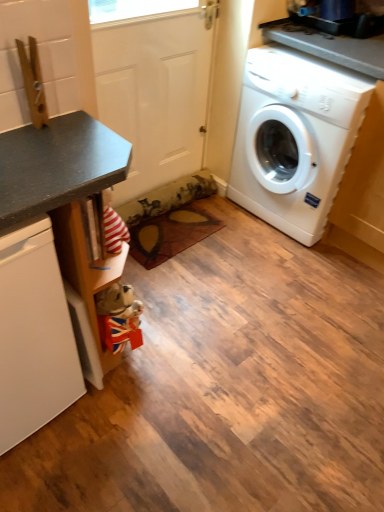
Question: Does white plastic washing machine at right have a lesser height compared to white matte dishwasher at left?

Choices:
 (A) yes
 (B) no

Answer: (B)

Question: Does white plastic washing machine at right touch white matte dishwasher at left?

Choices:
 (A) no
 (B) yes

Answer: (A)

Question: Does white plastic washing machine at right turn towards white matte dishwasher at left?

Choices:
 (A) yes
 (B) no

Answer: (A)

Question: Is white plastic washing machine at right further to the viewer compared to white matte dishwasher at left?

Choices:
 (A) yes
 (B) no

Answer: (A)

Question: From the image's perspective, is white plastic washing machine at right located beneath white matte dishwasher at left?

Choices:
 (A) yes
 (B) no

Answer: (B)

Question: Considering the relative sizes of white plastic washing machine at right and white matte dishwasher at left in the image provided, is white plastic washing machine at right smaller than white matte dishwasher at left?

Choices:
 (A) no
 (B) yes

Answer: (A)

Question: Considering the relative positions of white matte dishwasher at left and matte black counter at left in the image provided, is white matte dishwasher at left to the left of matte black counter at left from the viewer's perspective?

Choices:
 (A) no
 (B) yes

Answer: (B)

Question: Does white matte dishwasher at left have a greater width compared to matte black counter at left?

Choices:
 (A) yes
 (B) no

Answer: (B)

Question: Considering the relative sizes of white matte dishwasher at left and matte black counter at left in the image provided, is white matte dishwasher at left thinner than matte black counter at left?

Choices:
 (A) yes
 (B) no

Answer: (A)

Question: From a real-world perspective, is white matte dishwasher at left below matte black counter at left?

Choices:
 (A) no
 (B) yes

Answer: (B)

Question: Can you confirm if white matte dishwasher at left is taller than matte black counter at left?

Choices:
 (A) yes
 (B) no

Answer: (B)

Question: Does white matte dishwasher at left lie in front of matte black counter at left?

Choices:
 (A) yes
 (B) no

Answer: (B)

Question: Is white matte door at center to the left of matte black counter at left from the viewer's perspective?

Choices:
 (A) no
 (B) yes

Answer: (A)